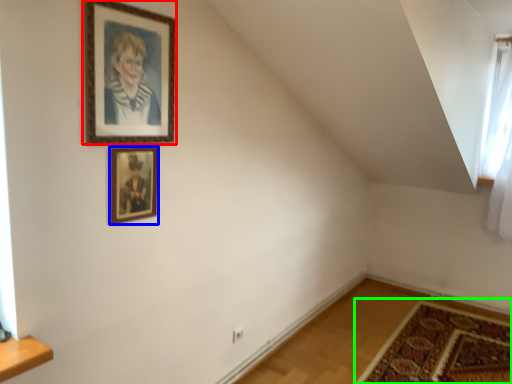
Question: Considering the real-world distances, which object is closest to picture frame (highlighted by a red box)? picture frame (highlighted by a blue box) or mat (highlighted by a green box).

Choices:
 (A) picture frame
 (B) mat

Answer: (A)